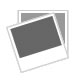
Locate an element on the screen. picture is located at coordinates pyautogui.click(x=32, y=63).